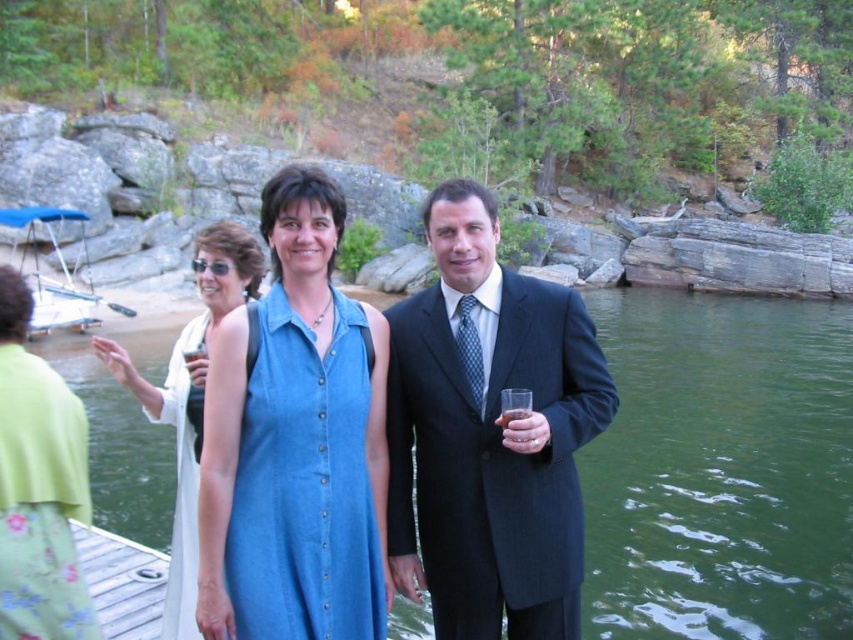
Based on the photo, you are a photographer at a lakeside event. You need to capture a photo of the dark blue pinstripe suit at center and the white satin dress at center. Which one is positioned to the right of the other?

The dark blue pinstripe suit at center is positioned on the right side of white satin dress at center.